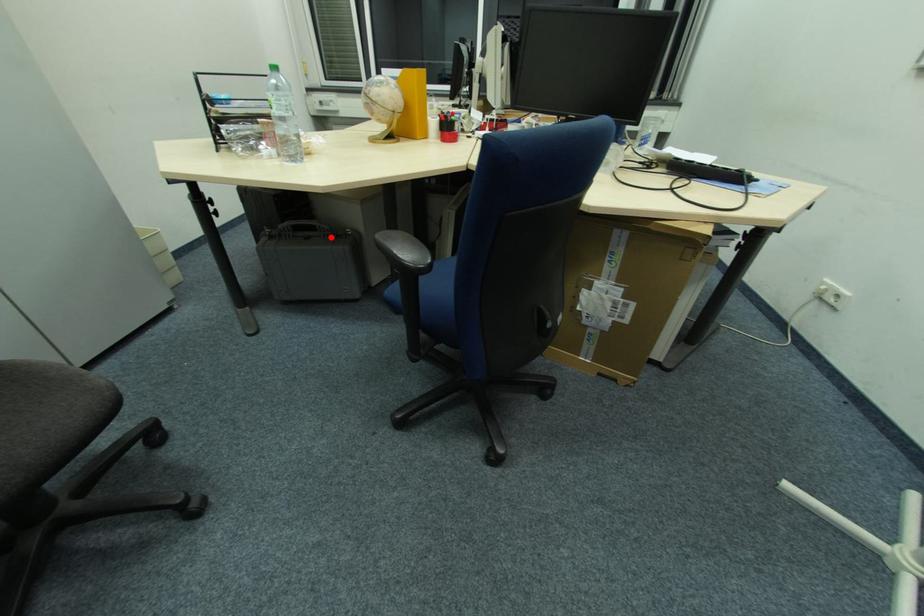
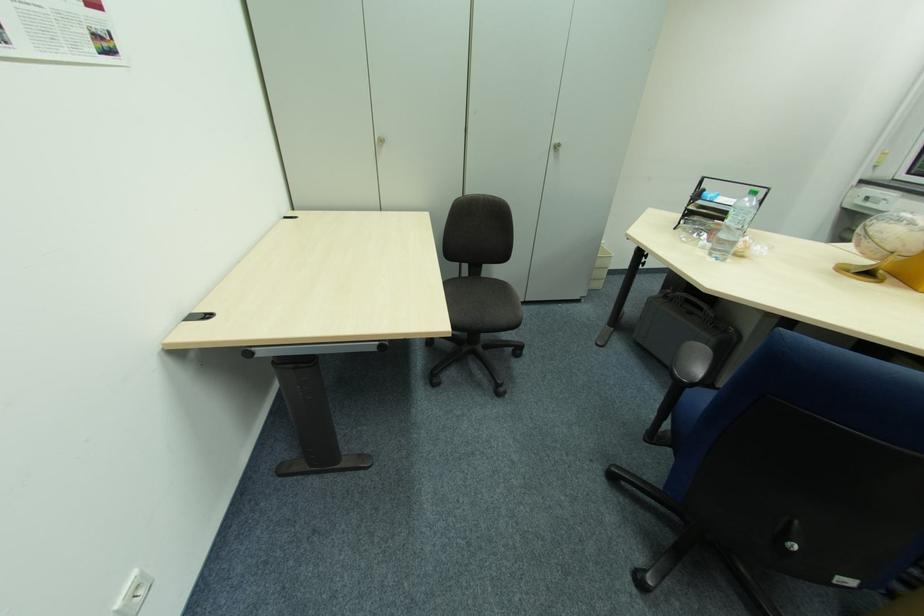
Find the pixel in the second image that matches the highlighted location in the first image.

(711, 323)